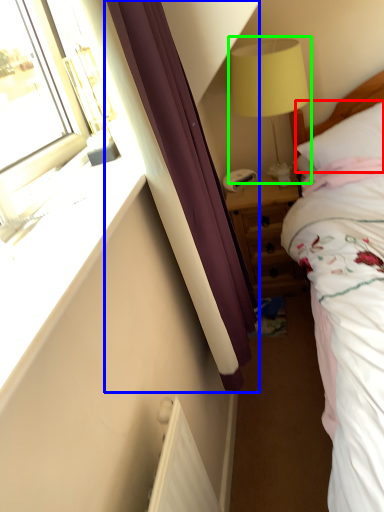
Question: Based on their relative distances, which object is farther from pillow (highlighted by a red box)? Choose from curtain (highlighted by a blue box) and table lamp (highlighted by a green box).

Choices:
 (A) curtain
 (B) table lamp

Answer: (A)